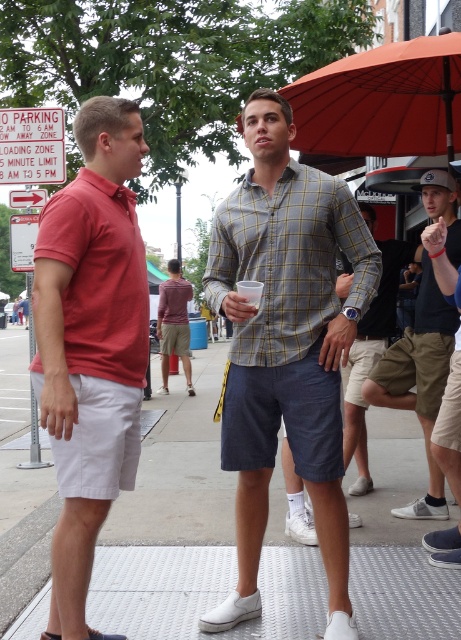
Is point (270, 209) positioned before point (380, 404)?

Yes, point (270, 209) is in front of point (380, 404).

Who is positioned more to the left, gray checkered shirt at center or matte khaki shorts at center?

gray checkered shirt at center

Between point (229, 211) and point (406, 397), which one is positioned in front?

Point (229, 211) is more forward.

Where is `gray checkered shirt at center`? gray checkered shirt at center is located at coordinates (289, 260).

Can you confirm if khaki cotton shorts at lower right is shorter than clear plastic cup at center?

In fact, khaki cotton shorts at lower right may be taller than clear plastic cup at center.

Between khaki cotton shorts at lower right and clear plastic cup at center, which one appears on the right side from the viewer's perspective?

From the viewer's perspective, khaki cotton shorts at lower right appears more on the right side.

What do you see at coordinates (372, 355) in the screenshot?
I see `khaki cotton shorts at lower right` at bounding box center [372, 355].

Where is `khaki cotton shorts at lower right`? khaki cotton shorts at lower right is located at coordinates (372, 355).

Is denim shorts at center to the left of maroon fabric shirt at center from the viewer's perspective?

In fact, denim shorts at center is to the right of maroon fabric shirt at center.

Between denim shorts at center and maroon fabric shirt at center, which one appears on the left side from the viewer's perspective?

maroon fabric shirt at center

Is point (453, 493) farther from camera compared to point (183, 294)?

No, it is not.

This screenshot has height=640, width=461. I want to click on denim shorts at center, so click(449, 426).